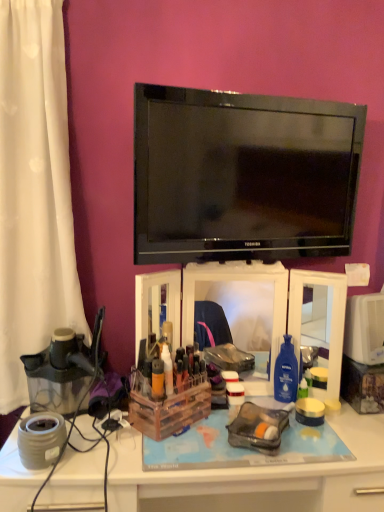
Question: Does wooden/clear plastic storage box at center have a larger size compared to transparent plastic makeup organizer at center?

Choices:
 (A) no
 (B) yes

Answer: (A)

Question: Is wooden/clear plastic storage box at center facing towards transparent plastic makeup organizer at center?

Choices:
 (A) no
 (B) yes

Answer: (A)

Question: Can you confirm if wooden/clear plastic storage box at center is positioned to the left of transparent plastic makeup organizer at center?

Choices:
 (A) yes
 (B) no

Answer: (A)

Question: Can you confirm if wooden/clear plastic storage box at center is wider than transparent plastic makeup organizer at center?

Choices:
 (A) no
 (B) yes

Answer: (B)

Question: Is transparent plastic makeup organizer at center located within wooden/clear plastic storage box at center?

Choices:
 (A) no
 (B) yes

Answer: (A)

Question: Is wooden/clear plastic storage box at center taller than transparent plastic makeup organizer at center?

Choices:
 (A) yes
 (B) no

Answer: (B)

Question: From a real-world perspective, is wooden/clear plastic storage box at center positioned over transparent plastic juicer at left based on gravity?

Choices:
 (A) no
 (B) yes

Answer: (A)

Question: Is wooden/clear plastic storage box at center positioned with its back to transparent plastic juicer at left?

Choices:
 (A) no
 (B) yes

Answer: (A)

Question: From a real-world perspective, is wooden/clear plastic storage box at center below transparent plastic juicer at left?

Choices:
 (A) no
 (B) yes

Answer: (B)

Question: Would you consider wooden/clear plastic storage box at center to be distant from transparent plastic juicer at left?

Choices:
 (A) yes
 (B) no

Answer: (B)

Question: Considering the relative sizes of wooden/clear plastic storage box at center and transparent plastic juicer at left in the image provided, is wooden/clear plastic storage box at center smaller than transparent plastic juicer at left?

Choices:
 (A) no
 (B) yes

Answer: (B)

Question: Can you confirm if wooden/clear plastic storage box at center is thinner than transparent plastic juicer at left?

Choices:
 (A) no
 (B) yes

Answer: (B)

Question: Is white plastic desk at lower center at the left side of black glossy tv at upper center?

Choices:
 (A) no
 (B) yes

Answer: (B)